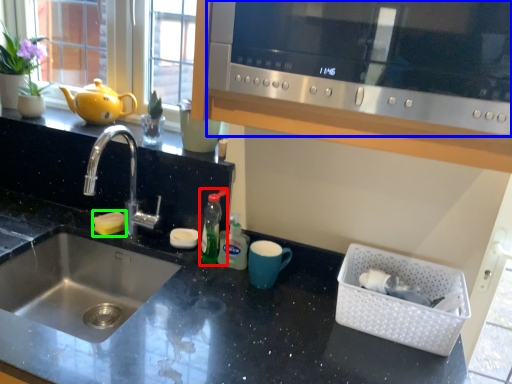
Question: Which object is the closest to the bottle (highlighted by a red box)? Choose among these: microwave (highlighted by a blue box) or food (highlighted by a green box).

Choices:
 (A) microwave
 (B) food

Answer: (B)